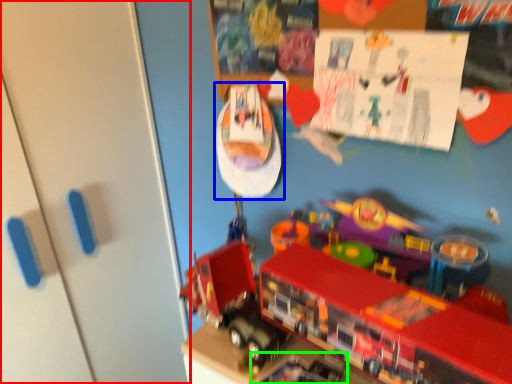
Question: Estimate the real-world distances between objects in this image. Which object is closer to door (highlighted by a red box), toy (highlighted by a blue box) or toy (highlighted by a green box)?

Choices:
 (A) toy
 (B) toy

Answer: (A)